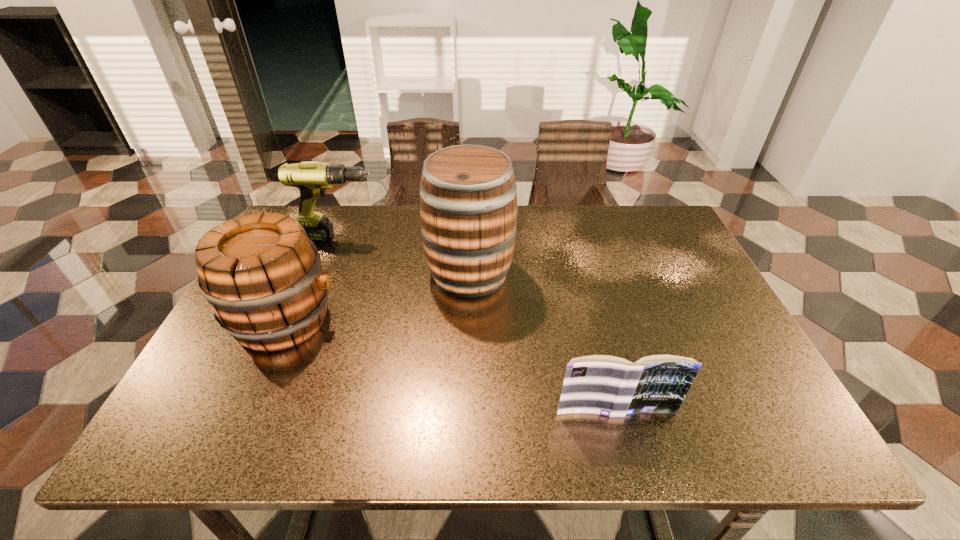
The width and height of the screenshot is (960, 540). What are the coordinates of `the taller cider` in the screenshot? It's located at (468, 194).

Where is `the second object from right to left`? Image resolution: width=960 pixels, height=540 pixels. the second object from right to left is located at coordinates (468, 194).

Find the location of a particular element. The height and width of the screenshot is (540, 960). the farthest object is located at coordinates (312, 178).

Where is `the left cider`? This screenshot has height=540, width=960. the left cider is located at coordinates (262, 276).

Where is `the rightmost object`? The image size is (960, 540). the rightmost object is located at coordinates (606, 385).

The height and width of the screenshot is (540, 960). In order to click on book in this screenshot , I will do `click(606, 385)`.

Where is `vacant region located 0.110m on the left of the right cider`? vacant region located 0.110m on the left of the right cider is located at coordinates (386, 272).

Where is `vacant space situated 0.350m on the handle side of the farthest object`? vacant space situated 0.350m on the handle side of the farthest object is located at coordinates (496, 238).

This screenshot has height=540, width=960. Identify the location of free space located on the side of the shorter cider where the spigot is located. (409, 319).

The image size is (960, 540). Identify the location of cider present at the far edge. (468, 194).